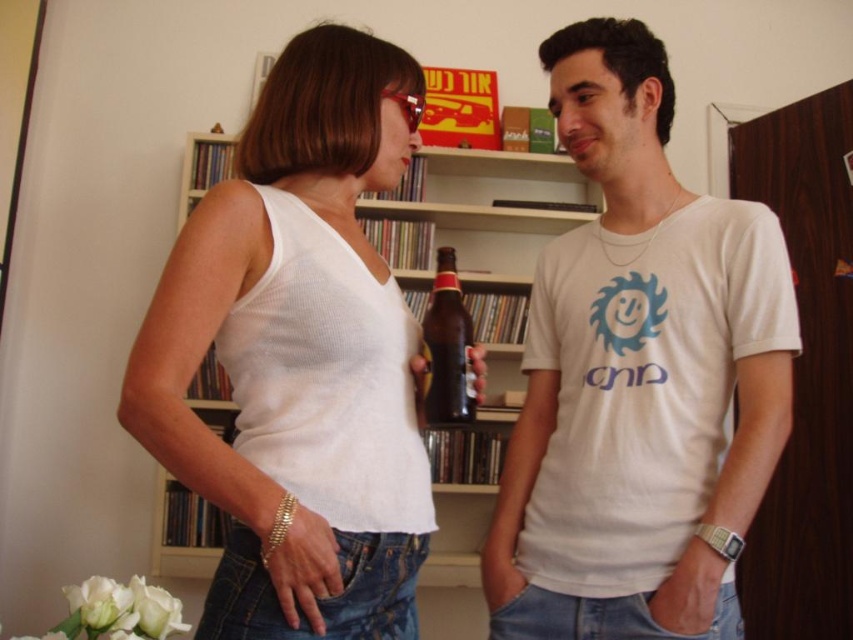
How much distance is there between white ribbed tank top at center and brown glass bottle at center?

They are 19.29 centimeters apart.

Can you confirm if white ribbed tank top at center is thinner than brown glass bottle at center?

No.

Who is more forward, (335, 36) or (448, 396)?

Point (448, 396) is in front.

Locate an element on the screen. The height and width of the screenshot is (640, 853). white ribbed tank top at center is located at coordinates (299, 356).

Which is above, white cotton t-shirt at center or white ribbed tank top at center?

white ribbed tank top at center

Locate an element on the screen. This screenshot has height=640, width=853. white cotton t-shirt at center is located at coordinates (637, 376).

Is point (639, 577) positioned in front of point (386, 445)?

No, (639, 577) is further to viewer.

Where is `white cotton t-shirt at center`? The image size is (853, 640). white cotton t-shirt at center is located at coordinates (637, 376).

Is point (521, 515) positioned before point (434, 346)?

No, it is not.

Between white cotton t-shirt at center and brown glass bottle at center, which one appears on the left side from the viewer's perspective?

Positioned to the left is brown glass bottle at center.

Is point (610, 312) positioned behind point (422, 346)?

Yes, point (610, 312) is behind point (422, 346).

This screenshot has height=640, width=853. I want to click on white cotton t-shirt at center, so click(x=637, y=376).